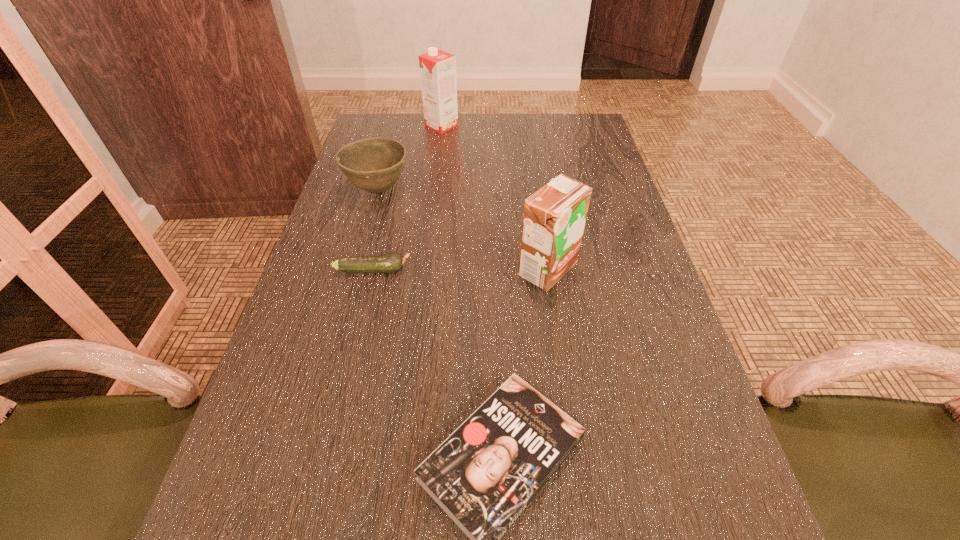
You are a GUI agent. You are given a task and a screenshot of the screen. Output one action in this format:
    pyautogui.click(x=<x>, y=<y>)
    Task: Click on the free space at the far right corner
    
    Given the screenshot: What is the action you would take?
    pyautogui.click(x=598, y=129)

Image resolution: width=960 pixels, height=540 pixels. Find the location of `vacant area that lies between the nearer carton and the bowl`. vacant area that lies between the nearer carton and the bowl is located at coordinates (463, 230).

The height and width of the screenshot is (540, 960). Identify the location of free space between the second shortest object and the second farthest object. (375, 230).

Locate an element on the screen. vacant space that is in between the fourth nearest object and the zucchini is located at coordinates (375, 230).

Locate an element on the screen. free space between the second farthest object and the right carton is located at coordinates (463, 230).

At what (x,y) coordinates should I click in order to perform the action: click on free spot between the farthest object and the nearer carton. Please return your answer as a coordinate pair (x, y). The image size is (960, 540). Looking at the image, I should click on (494, 198).

Where is `object that ranks as the fourth closest to the bowl`? Image resolution: width=960 pixels, height=540 pixels. object that ranks as the fourth closest to the bowl is located at coordinates (484, 475).

Where is `object that ranks as the second closest to the nearer carton`? The width and height of the screenshot is (960, 540). object that ranks as the second closest to the nearer carton is located at coordinates (392, 262).